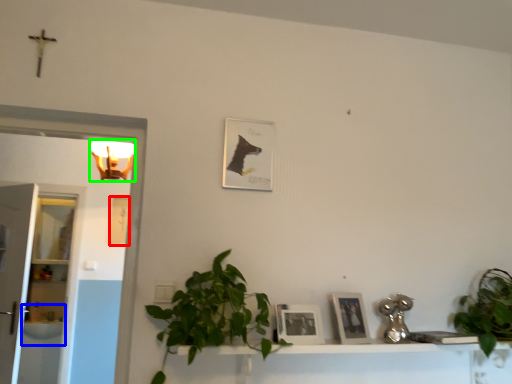
Question: Which object is positioned farthest from picture frame (highlighted by a red box)? Select from sink (highlighted by a blue box) and light fixture (highlighted by a green box).

Choices:
 (A) sink
 (B) light fixture

Answer: (A)